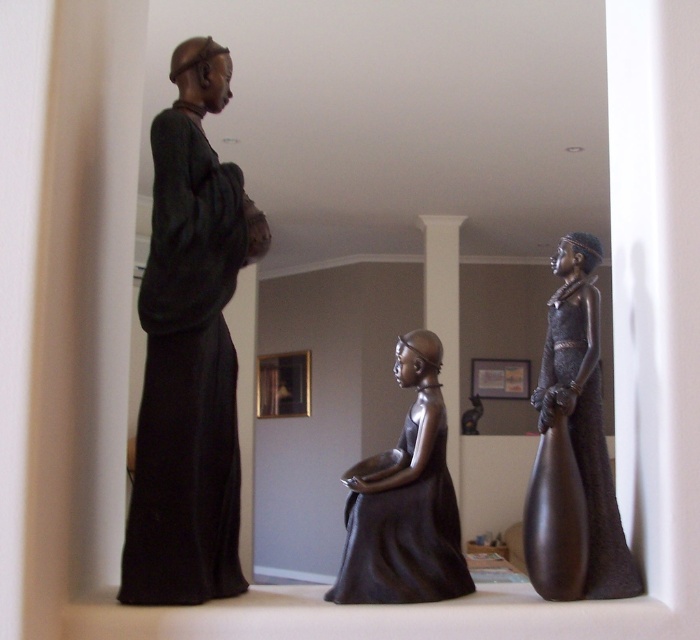
You are a GUI agent. You are given a task and a screenshot of the screen. Output one action in this format:
    pyautogui.click(x=<x>, y=<y>)
    Task: Click on the matte black robe at left
    This screenshot has height=640, width=700.
    Given the screenshot: What is the action you would take?
    pyautogui.click(x=186, y=378)

Is point (134, 532) farther from camera compared to point (592, 458)?

No, (134, 532) is closer to viewer.

Locate an element on the screen. This screenshot has width=700, height=640. matte black robe at left is located at coordinates tap(186, 378).

Between matte black robe at left and matte black statue at center, which one has more height?

With more height is matte black robe at left.

Measure the distance between point (183, 410) and camera.

The distance of point (183, 410) from camera is 4.12 feet.

The height and width of the screenshot is (640, 700). I want to click on matte black robe at left, so [x=186, y=378].

Does point (370, 490) come closer to viewer compared to point (601, 433)?

Yes, it is.

Which is below, matte black statue at center or shiny dark brown dress at right?

matte black statue at center

The width and height of the screenshot is (700, 640). In order to click on matte black statue at center in this screenshot , I will do `click(406, 500)`.

The image size is (700, 640). I want to click on matte black statue at center, so click(406, 500).